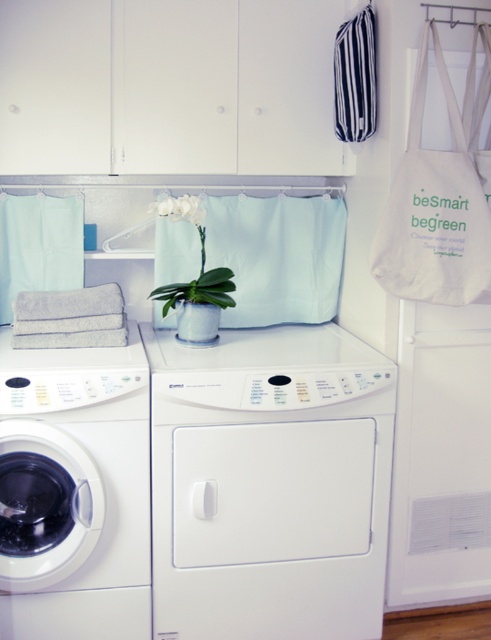
Between white matte dryer at center and white glossy washing machine at left, which one appears on the right side from the viewer's perspective?

From the viewer's perspective, white matte dryer at center appears more on the right side.

Is point (256, 596) more distant than point (74, 356)?

No, (256, 596) is closer to viewer.

Does point (195, 392) come behind point (132, 618)?

No, (195, 392) is in front of (132, 618).

Where is `white matte dryer at center`? This screenshot has width=491, height=640. white matte dryer at center is located at coordinates (x=270, y=483).

Is mint fabric laundry at upper center to the right of gray terry towel at center from the viewer's perspective?

No, mint fabric laundry at upper center is not to the right of gray terry towel at center.

Where is `mint fabric laundry at upper center`? mint fabric laundry at upper center is located at coordinates (38, 244).

Is mint fabric laundry at upper center shorter than white matte orchid at center?

In fact, mint fabric laundry at upper center may be taller than white matte orchid at center.

Is point (69, 257) closer to viewer compared to point (186, 214)?

No, (69, 257) is behind (186, 214).

Which is in front, point (43, 196) or point (190, 211)?

Point (190, 211)

You are a GUI agent. You are given a task and a screenshot of the screen. Output one action in this format:
    pyautogui.click(x=<x>, y=<y>)
    Task: Click on the mint fabric laundry at upper center
    This screenshot has width=491, height=640.
    Given the screenshot: What is the action you would take?
    pyautogui.click(x=38, y=244)